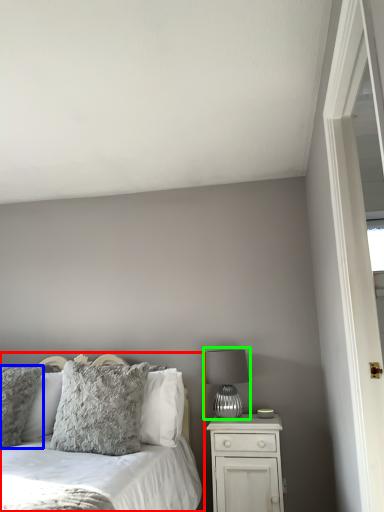
Question: Based on their relative distances, which object is nearer to bed (highlighted by a red box)? Choose from pillow (highlighted by a blue box) and table lamp (highlighted by a green box).

Choices:
 (A) pillow
 (B) table lamp

Answer: (A)